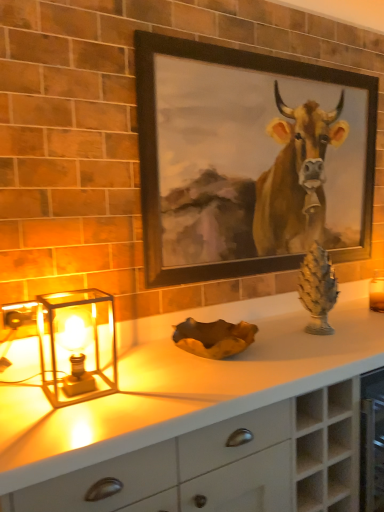
Identify the location of free space above white matte countertop at center (from a real-world perspective). (143, 374).